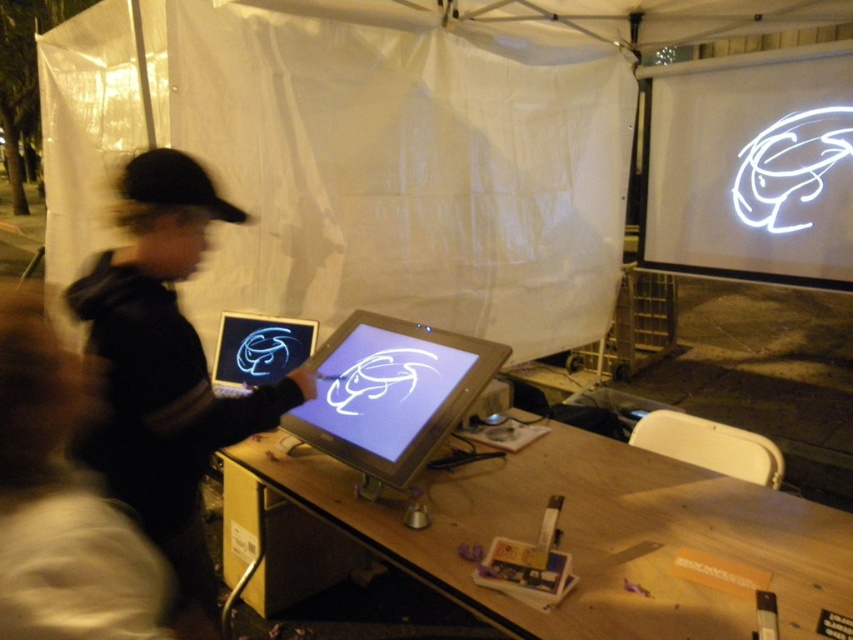
Question: Which point is farther from the camera taking this photo?

Choices:
 (A) (178, 348)
 (B) (131, 532)
 (C) (664, 460)
 (D) (250, 371)

Answer: (D)

Question: Among these points, which one is nearest to the camera?

Choices:
 (A) (664, 600)
 (B) (848, 68)

Answer: (A)

Question: Which object is positioned farthest from the black matte baseball hat at left?

Choices:
 (A) wooden table at center
 (B) black matte jacket at left
 (C) matte plastic screen at center

Answer: (A)

Question: From the image, what is the correct spatial relationship of wooden table at center in relation to black matte jacket at left?

Choices:
 (A) below
 (B) above

Answer: (A)

Question: Where is wooden table at center located in relation to white glossy projection screen at upper right in the image?

Choices:
 (A) left
 (B) right

Answer: (A)

Question: Is matte plastic screen at center bigger than black matte baseball hat at left?

Choices:
 (A) no
 (B) yes

Answer: (B)